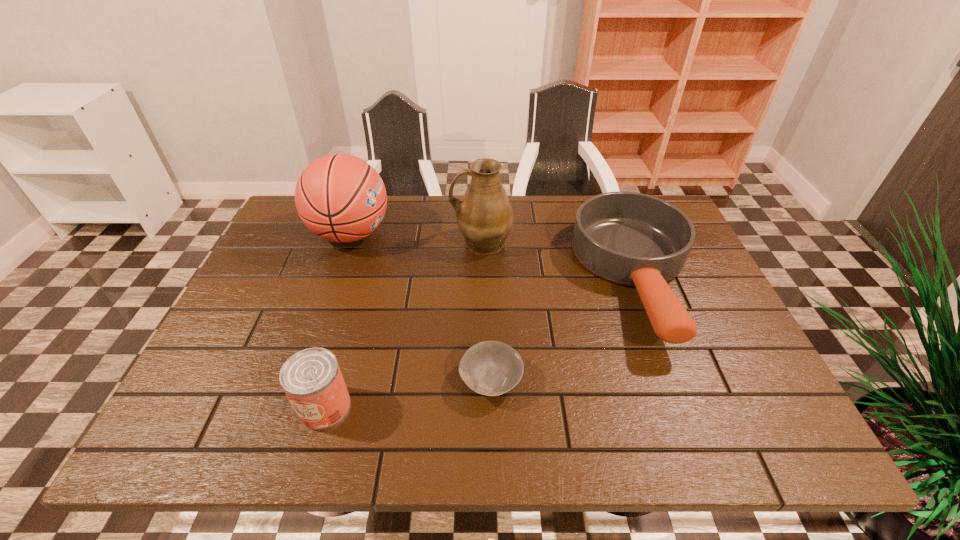
Where is `vacant point located on the right of the bowl`? Image resolution: width=960 pixels, height=540 pixels. vacant point located on the right of the bowl is located at coordinates (656, 380).

The image size is (960, 540). Identify the location of pitcher that is positioned at the far edge. (484, 215).

Find the location of `basketball present at the far edge`. basketball present at the far edge is located at coordinates (340, 197).

Find the location of `pan at the far edge`. pan at the far edge is located at coordinates (633, 239).

I want to click on can that is positioned at the near edge, so click(x=312, y=380).

The image size is (960, 540). Identify the location of bowl that is at the near edge. (492, 368).

Locate an element on the screen. object positioned at the left edge is located at coordinates (340, 197).

Where is `object that is at the right edge`? This screenshot has width=960, height=540. object that is at the right edge is located at coordinates (633, 239).

You are a GUI agent. You are given a task and a screenshot of the screen. Output one action in this format:
    pyautogui.click(x=<x>, y=<y>)
    Task: Click on the object located at the far left corner
    This screenshot has height=540, width=960.
    Given the screenshot: What is the action you would take?
    pyautogui.click(x=340, y=197)

I want to click on object positioned at the far right corner, so click(633, 239).